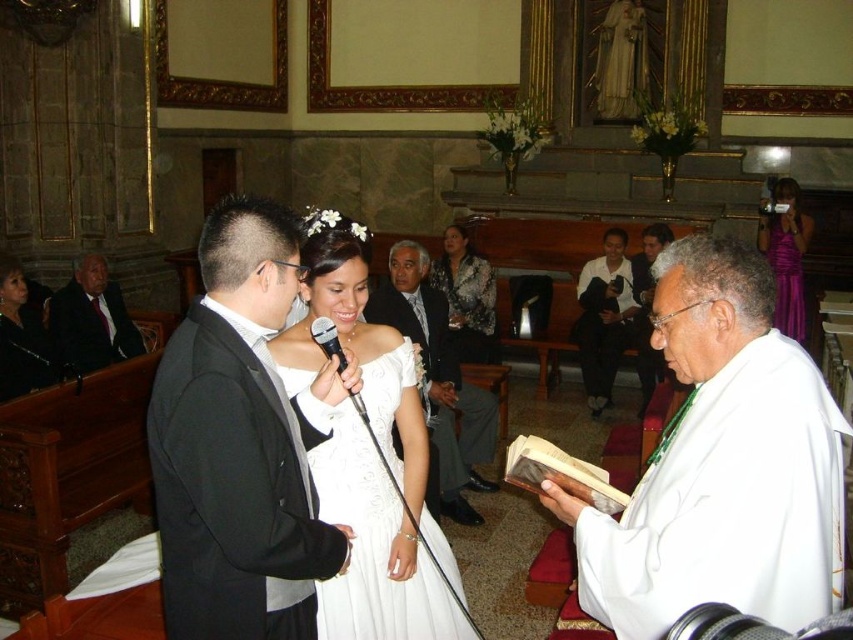
Question: Which of the following is the closest to the observer?

Choices:
 (A) dark suit at left
 (B) black satin dress at left

Answer: (B)

Question: In this image, where is dark suit at left located relative to black satin dress at left?

Choices:
 (A) below
 (B) above

Answer: (A)

Question: Which point appears closest to the camera in this image?

Choices:
 (A) click(466, 250)
 (B) click(606, 385)
 (C) click(790, 189)
 (D) click(67, 321)

Answer: (D)

Question: Can you confirm if white satin suit at center is smaller than white shirt at center?

Choices:
 (A) yes
 (B) no

Answer: (B)

Question: Among these objects, which one is farthest from the camera?

Choices:
 (A) white satin suit at center
 (B) black satin dress at left
 (C) floral-patterned dress at center
 (D) black satin suit at center

Answer: (C)

Question: Where is white shirt at center located in relation to purple satin dress at upper right in the image?

Choices:
 (A) right
 (B) left

Answer: (B)